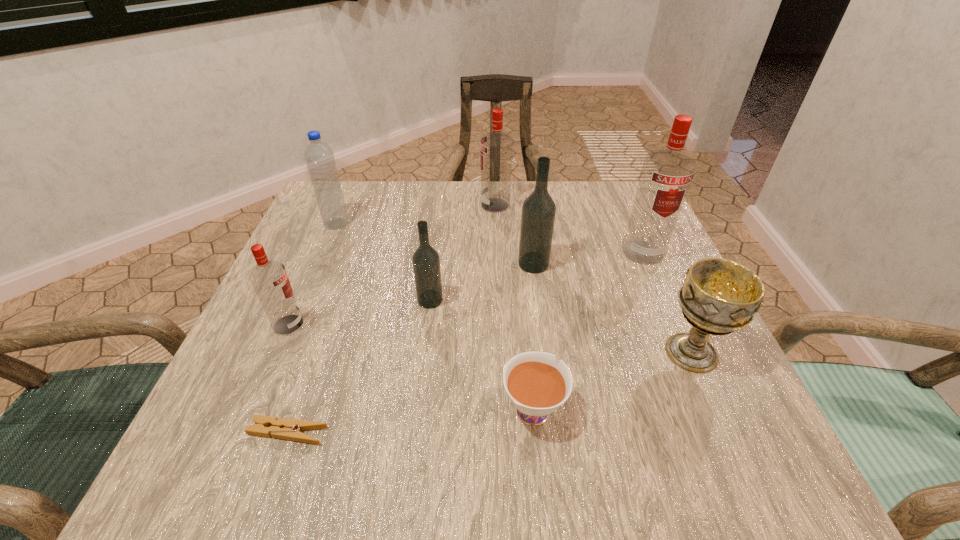
The image size is (960, 540). What are the coordinates of `unoccupied position between the blue water bottle and the rightmost vodka` in the screenshot? It's located at (490, 238).

Identify the location of vacant space in between the eighth tallest object and the fourth vodka from left to right. [x=533, y=335].

The width and height of the screenshot is (960, 540). Identify the location of free spot between the biggest red vodka and the fourth farthest vodka. (537, 276).

Where is `free space between the white chalice and the rightmost red vodka`? free space between the white chalice and the rightmost red vodka is located at coordinates (667, 302).

The width and height of the screenshot is (960, 540). I want to click on vacant area between the biggest red vodka and the white teacup, so click(x=588, y=329).

Where is `free space between the tallest object and the chalice`? The height and width of the screenshot is (540, 960). free space between the tallest object and the chalice is located at coordinates (667, 302).

At what (x,y) coordinates should I click in order to perform the action: click on free area in between the second farthest red vodka and the water bottle. Please return your answer as a coordinate pair (x, y). This screenshot has width=960, height=540. Looking at the image, I should click on (490, 238).

Select which object is the fifth closest to the leftmost vodka. Please provide its 2D coordinates. Your answer should be formatted as a tuple, i.e. [(x, y)], where the tuple contains the x and y coordinates of a point satisfying the conditions above.

[(538, 211)]

This screenshot has height=540, width=960. I want to click on object that is the second closest one to the blue water bottle, so click(426, 262).

Where is `vodka that is the fourth closest to the second red vodka from left to right`? This screenshot has width=960, height=540. vodka that is the fourth closest to the second red vodka from left to right is located at coordinates (269, 278).